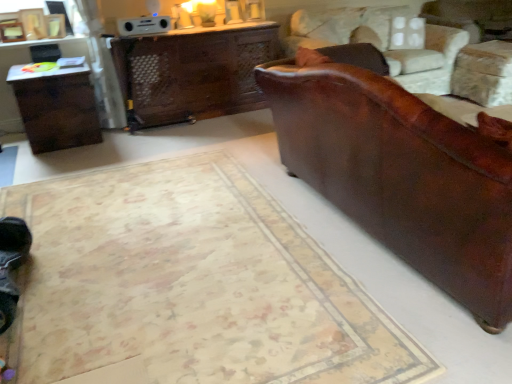
Question: From a real-world perspective, is wooden desk at center physically above dark brown wood table at left?

Choices:
 (A) yes
 (B) no

Answer: (A)

Question: Could you tell me if wooden desk at center is turned towards dark brown wood table at left?

Choices:
 (A) yes
 (B) no

Answer: (B)

Question: Is wooden desk at center positioned beyond the bounds of dark brown wood table at left?

Choices:
 (A) yes
 (B) no

Answer: (A)

Question: From the image's perspective, is wooden desk at center over dark brown wood table at left?

Choices:
 (A) yes
 (B) no

Answer: (A)

Question: Is wooden desk at center next to dark brown wood table at left?

Choices:
 (A) no
 (B) yes

Answer: (A)

Question: Considering the relative positions of wooden desk at center and dark brown wood table at left in the image provided, is wooden desk at center to the left of dark brown wood table at left from the viewer's perspective?

Choices:
 (A) no
 (B) yes

Answer: (A)

Question: Is brown leather swivel chair at right beside leather couch at right?

Choices:
 (A) no
 (B) yes

Answer: (A)

Question: From the image's perspective, is brown leather swivel chair at right over leather couch at right?

Choices:
 (A) no
 (B) yes

Answer: (B)

Question: Is brown leather swivel chair at right shorter than leather couch at right?

Choices:
 (A) no
 (B) yes

Answer: (B)

Question: Is brown leather swivel chair at right far away from leather couch at right?

Choices:
 (A) no
 (B) yes

Answer: (B)

Question: Considering the relative sizes of brown leather swivel chair at right and leather couch at right in the image provided, is brown leather swivel chair at right bigger than leather couch at right?

Choices:
 (A) yes
 (B) no

Answer: (B)

Question: Does brown leather swivel chair at right appear on the right side of leather couch at right?

Choices:
 (A) yes
 (B) no

Answer: (A)

Question: Considering the relative sizes of dark brown wood table at left and leather couch at right in the image provided, is dark brown wood table at left taller than leather couch at right?

Choices:
 (A) yes
 (B) no

Answer: (B)